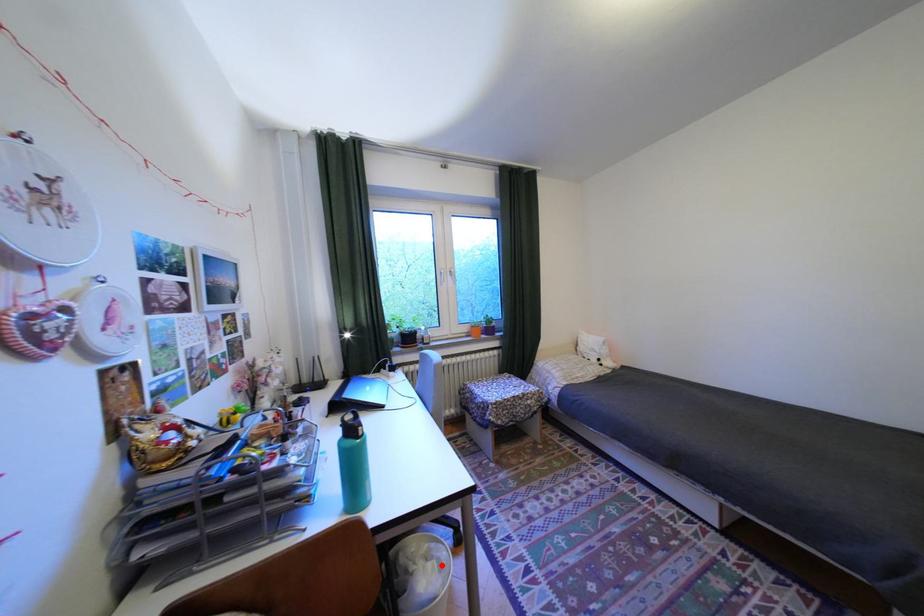
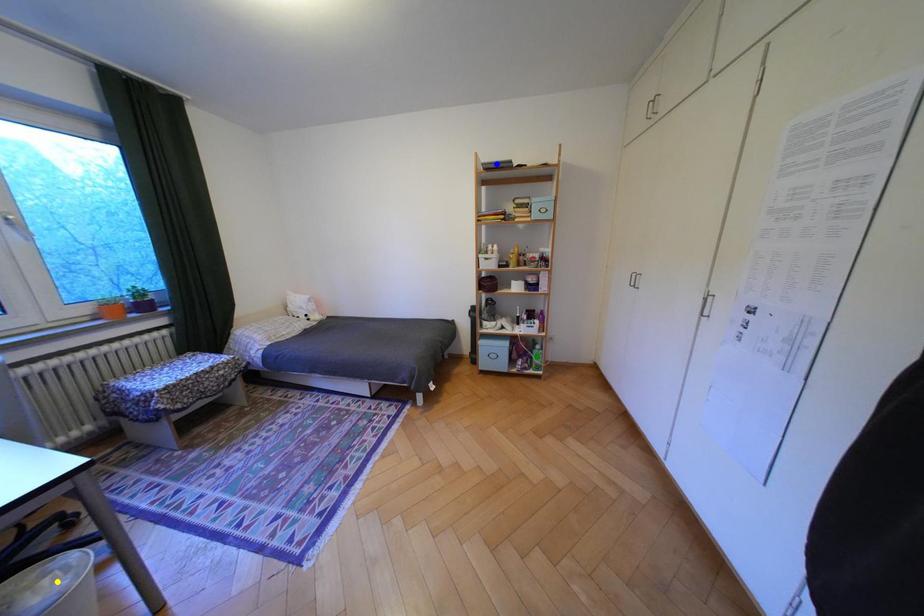
Question: I am providing you with two images of the same scene from different viewpoints. A red point is marked on the first image. You are given multiple points on the second image. In image 2, which mark is for the same physical point as the one in image 1?

Choices:
 (A) yellow point
 (B) blue point
 (C) green point

Answer: (A)